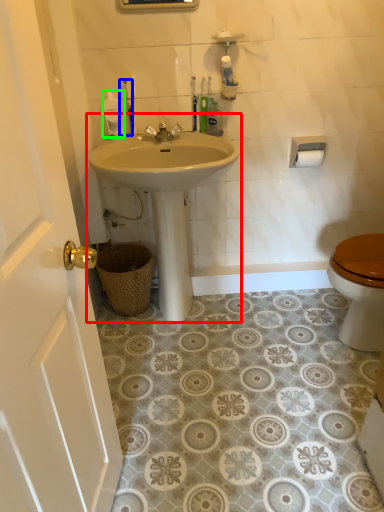
Question: Which object is the closest to the sink (highlighted by a red box)? Choose among these: toiletry (highlighted by a blue box) or toiletry (highlighted by a green box).

Choices:
 (A) toiletry
 (B) toiletry

Answer: (B)